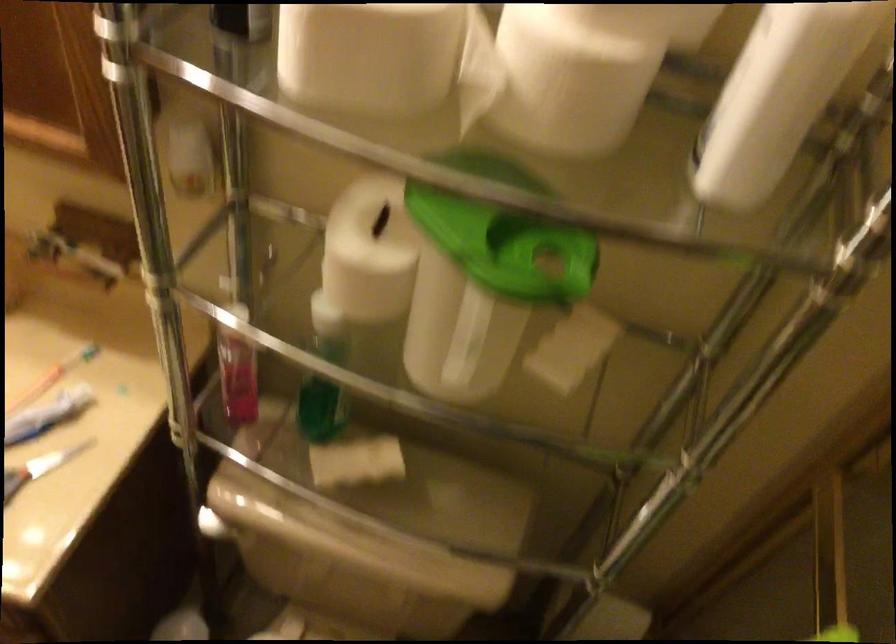
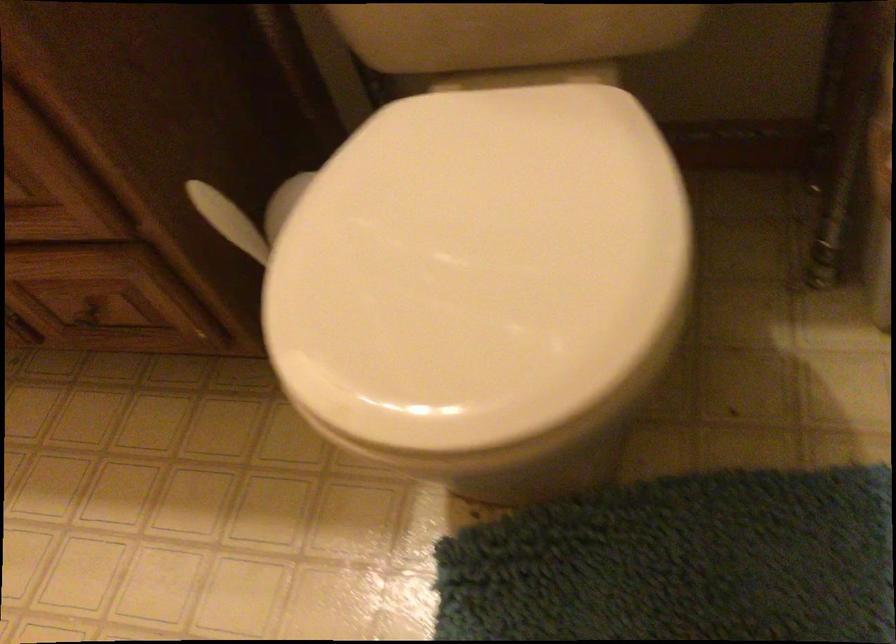
Question: The first image is from the beginning of the video and the second image is from the end. How did the camera likely rotate when shooting the video?

Choices:
 (A) Left
 (B) Right
 (C) Up
 (D) Down

Answer: (A)